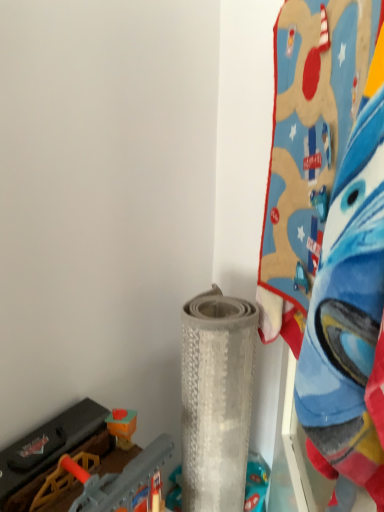
Describe the element at coordinates (83, 466) in the screenshot. I see `plastic toy train at lower left, positioned as the third toy in right-to-left order` at that location.

Image resolution: width=384 pixels, height=512 pixels. Find the location of `blue plush blanket at upper right, which is the 1th toy from right to left`. blue plush blanket at upper right, which is the 1th toy from right to left is located at coordinates (308, 146).

Would you say plastic toy train at lower left, placed as the first toy when sorted from left to right, is outside gray textured mat at center, the second toy viewed from the left?

Yes, plastic toy train at lower left, placed as the first toy when sorted from left to right, is outside of gray textured mat at center, the second toy viewed from the left.

Is plastic toy train at lower left, positioned as the third toy in right-to-left order, in contact with gray textured mat at center, acting as the second toy starting from the right?

No, plastic toy train at lower left, positioned as the third toy in right-to-left order, is not next to gray textured mat at center, acting as the second toy starting from the right.

Looking at the image, does plastic toy train at lower left, positioned as the third toy in right-to-left order, seem bigger or smaller compared to gray textured mat at center, the second toy viewed from the left?

plastic toy train at lower left, positioned as the third toy in right-to-left order, is smaller than gray textured mat at center, the second toy viewed from the left.

Can you confirm if plastic toy train at lower left, positioned as the third toy in right-to-left order, is thinner than gray textured mat at center, acting as the second toy starting from the right?

No.

From the picture: Considering the relative sizes of plastic toy train at lower left, placed as the first toy when sorted from left to right, and blue plush blanket at upper right, which is the 1th toy from right to left, in the image provided, is plastic toy train at lower left, placed as the first toy when sorted from left to right, taller than blue plush blanket at upper right, which is the 1th toy from right to left,?

Incorrect, the height of plastic toy train at lower left, placed as the first toy when sorted from left to right, is not larger of that of blue plush blanket at upper right, which is the 1th toy from right to left.

Is plastic toy train at lower left, placed as the first toy when sorted from left to right, not near blue plush blanket at upper right, which is the 1th toy from right to left?

plastic toy train at lower left, placed as the first toy when sorted from left to right, is actually quite close to blue plush blanket at upper right, which is the 1th toy from right to left.

From a real-world perspective, is plastic toy train at lower left, positioned as the third toy in right-to-left order, on blue plush blanket at upper right, the 3th toy positioned from the left?

No.

Which of these two, plastic toy train at lower left, positioned as the third toy in right-to-left order, or blue plush blanket at upper right, the 3th toy positioned from the left, is bigger?

Bigger between the two is blue plush blanket at upper right, the 3th toy positioned from the left.

From a real-world perspective, is blue plush blanket at upper right, which is the 1th toy from right to left, positioned over gray textured mat at center, acting as the second toy starting from the right, based on gravity?

Yes, from a real-world perspective, blue plush blanket at upper right, which is the 1th toy from right to left, is on top of gray textured mat at center, acting as the second toy starting from the right.

Is blue plush blanket at upper right, the 3th toy positioned from the left, located outside gray textured mat at center, acting as the second toy starting from the right?

Yes, blue plush blanket at upper right, the 3th toy positioned from the left, is outside of gray textured mat at center, acting as the second toy starting from the right.

Can you confirm if blue plush blanket at upper right, which is the 1th toy from right to left, is taller than gray textured mat at center, the second toy viewed from the left?

Incorrect, the height of blue plush blanket at upper right, which is the 1th toy from right to left, is not larger of that of gray textured mat at center, the second toy viewed from the left.

Is blue plush blanket at upper right, which is the 1th toy from right to left, positioned in front of gray textured mat at center, the second toy viewed from the left?

Yes, it is.

Is gray textured mat at center, the second toy viewed from the left, inside or outside of plastic toy train at lower left, placed as the first toy when sorted from left to right?

gray textured mat at center, the second toy viewed from the left, cannot be found inside plastic toy train at lower left, placed as the first toy when sorted from left to right.

Considering the relative positions of gray textured mat at center, acting as the second toy starting from the right, and plastic toy train at lower left, placed as the first toy when sorted from left to right, in the image provided, is gray textured mat at center, acting as the second toy starting from the right, to the right of plastic toy train at lower left, placed as the first toy when sorted from left to right, from the viewer's perspective?

Correct, you'll find gray textured mat at center, acting as the second toy starting from the right, to the right of plastic toy train at lower left, placed as the first toy when sorted from left to right.

Based on the photo, which of these two, gray textured mat at center, the second toy viewed from the left, or plastic toy train at lower left, placed as the first toy when sorted from left to right, stands shorter?

plastic toy train at lower left, placed as the first toy when sorted from left to right, is shorter.

From the image's perspective, which one is positioned higher, gray textured mat at center, the second toy viewed from the left, or blue plush blanket at upper right, the 3th toy positioned from the left?

blue plush blanket at upper right, the 3th toy positioned from the left, from the image's perspective.

Considering the relative sizes of gray textured mat at center, acting as the second toy starting from the right, and blue plush blanket at upper right, the 3th toy positioned from the left, in the image provided, is gray textured mat at center, acting as the second toy starting from the right, wider than blue plush blanket at upper right, the 3th toy positioned from the left,?

Yes.

From a real-world perspective, is gray textured mat at center, acting as the second toy starting from the right, above or below blue plush blanket at upper right, which is the 1th toy from right to left?

From a real-world perspective, gray textured mat at center, acting as the second toy starting from the right, is physically below blue plush blanket at upper right, which is the 1th toy from right to left.

Is gray textured mat at center, the second toy viewed from the left, inside the boundaries of blue plush blanket at upper right, the 3th toy positioned from the left, or outside?

gray textured mat at center, the second toy viewed from the left, is outside blue plush blanket at upper right, the 3th toy positioned from the left.

Considering the points (321, 152) and (99, 495), which point is behind, point (321, 152) or point (99, 495)?

The point (99, 495) is behind.

Does blue plush blanket at upper right, which is the 1th toy from right to left, contain plastic toy train at lower left, positioned as the third toy in right-to-left order?

No, plastic toy train at lower left, positioned as the third toy in right-to-left order, is located outside of blue plush blanket at upper right, which is the 1th toy from right to left.

Considering the relative sizes of blue plush blanket at upper right, the 3th toy positioned from the left, and plastic toy train at lower left, positioned as the third toy in right-to-left order, in the image provided, is blue plush blanket at upper right, the 3th toy positioned from the left, wider than plastic toy train at lower left, positioned as the third toy in right-to-left order,?

No.

From a real-world perspective, relative to plastic toy train at lower left, placed as the first toy when sorted from left to right, is blue plush blanket at upper right, the 3th toy positioned from the left, vertically above or below?

blue plush blanket at upper right, the 3th toy positioned from the left, is above plastic toy train at lower left, placed as the first toy when sorted from left to right.

From the image's perspective, count 1st toys upward from the plastic toy train at lower left, placed as the first toy when sorted from left to right, and point to it. Please provide its 2D coordinates.

[(216, 399)]

Locate an element on the screen. toy lying in front of the plastic toy train at lower left, positioned as the third toy in right-to-left order is located at coordinates (308, 146).

When comparing their distances from plastic toy train at lower left, positioned as the third toy in right-to-left order, does gray textured mat at center, the second toy viewed from the left, or blue plush blanket at upper right, which is the 1th toy from right to left, seem closer?

The object closer to plastic toy train at lower left, positioned as the third toy in right-to-left order, is gray textured mat at center, the second toy viewed from the left.

When comparing their distances from plastic toy train at lower left, placed as the first toy when sorted from left to right, does blue plush blanket at upper right, which is the 1th toy from right to left, or gray textured mat at center, acting as the second toy starting from the right, seem further?

blue plush blanket at upper right, which is the 1th toy from right to left, is further to plastic toy train at lower left, placed as the first toy when sorted from left to right.

When comparing their distances from gray textured mat at center, the second toy viewed from the left, does plastic toy train at lower left, positioned as the third toy in right-to-left order, or blue plush blanket at upper right, which is the 1th toy from right to left, seem further?

Based on the image, blue plush blanket at upper right, which is the 1th toy from right to left, appears to be further to gray textured mat at center, the second toy viewed from the left.

Based on their spatial positions, is gray textured mat at center, acting as the second toy starting from the right, or plastic toy train at lower left, placed as the first toy when sorted from left to right, further from blue plush blanket at upper right, the 3th toy positioned from the left?

Among the two, plastic toy train at lower left, placed as the first toy when sorted from left to right, is located further to blue plush blanket at upper right, the 3th toy positioned from the left.

Based on their spatial positions, is blue plush blanket at upper right, the 3th toy positioned from the left, or plastic toy train at lower left, positioned as the third toy in right-to-left order, closer to gray textured mat at center, the second toy viewed from the left?

Based on the image, plastic toy train at lower left, positioned as the third toy in right-to-left order, appears to be nearer to gray textured mat at center, the second toy viewed from the left.

Based on their spatial positions, is plastic toy train at lower left, placed as the first toy when sorted from left to right, or gray textured mat at center, the second toy viewed from the left, further from blue plush blanket at upper right, which is the 1th toy from right to left?

plastic toy train at lower left, placed as the first toy when sorted from left to right, is positioned further to the anchor blue plush blanket at upper right, which is the 1th toy from right to left.

The height and width of the screenshot is (512, 384). What are the coordinates of `toy between blue plush blanket at upper right, which is the 1th toy from right to left, and plastic toy train at lower left, positioned as the third toy in right-to-left order, in the vertical direction` in the screenshot? It's located at (216, 399).